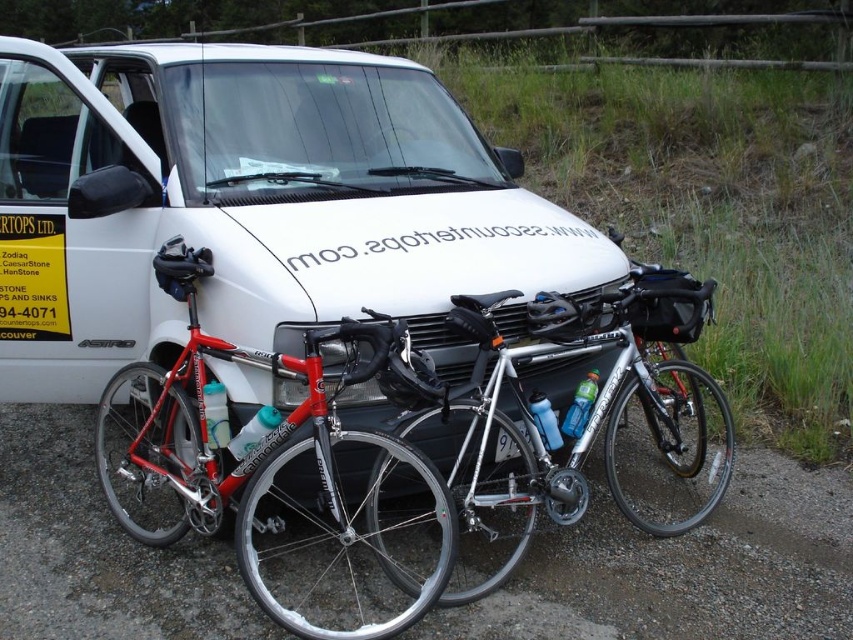
Question: Among these points, which one is nearest to the camera?

Choices:
 (A) (593, 371)
 (B) (218, 323)

Answer: (B)

Question: Where is white matte van at center located in relation to silver metallic bicycle at center in the image?

Choices:
 (A) left
 (B) right

Answer: (A)

Question: Which is nearer to the silver metallic bicycle at center?

Choices:
 (A) white matte van at center
 (B) shiny red bike at center

Answer: (B)

Question: Which object is farther from the camera taking this photo?

Choices:
 (A) shiny red bike at center
 (B) silver metallic bicycle at center
 (C) white matte van at center

Answer: (C)

Question: Can you confirm if white matte van at center is positioned above shiny red bike at center?

Choices:
 (A) no
 (B) yes

Answer: (B)

Question: Can you confirm if shiny red bike at center is smaller than silver metallic bicycle at center?

Choices:
 (A) no
 (B) yes

Answer: (B)